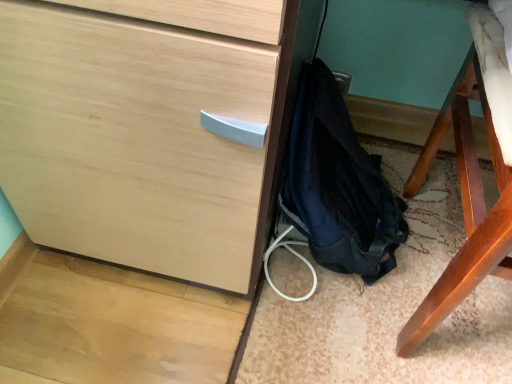
I want to click on free point to the right of dark blue fabric backpack at lower right, so click(x=399, y=300).